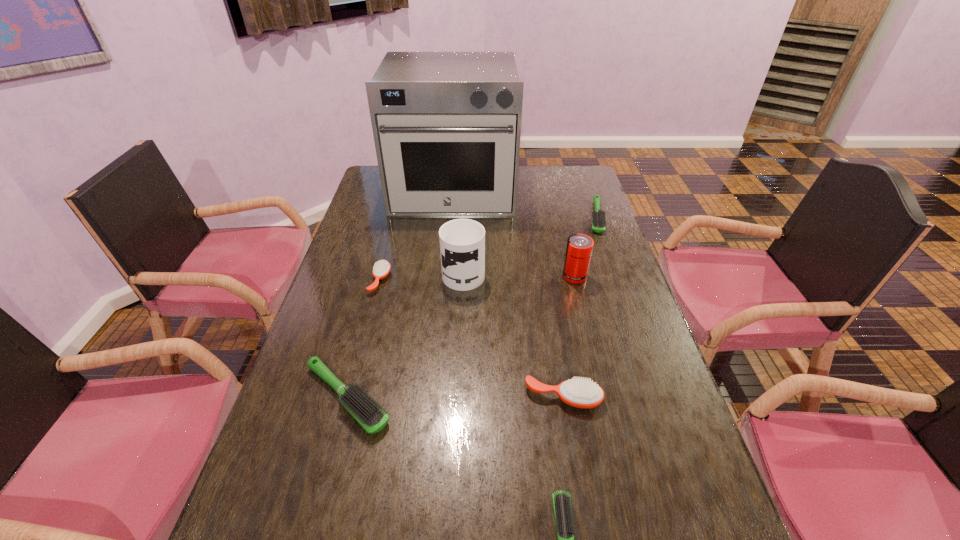
I want to click on the tallest object, so click(447, 125).

At what (x,y) coordinates should I click in order to perform the action: click on the seventh shortest object. Please return your answer as a coordinate pair (x, y). This screenshot has width=960, height=540. Looking at the image, I should click on (462, 241).

At what (x,y) coordinates should I click in order to perform the action: click on mug. Please return your answer as a coordinate pair (x, y). Image resolution: width=960 pixels, height=540 pixels. Looking at the image, I should click on (462, 241).

The height and width of the screenshot is (540, 960). What are the coordinates of `the third tallest object` in the screenshot? It's located at (579, 248).

What are the coordinates of `the bigger orange hairbrush` in the screenshot? It's located at (582, 393).

This screenshot has height=540, width=960. I want to click on the right orange hairbrush, so click(x=582, y=393).

Find the location of `the biggest light hairbrush`. the biggest light hairbrush is located at coordinates (367, 413).

The height and width of the screenshot is (540, 960). What are the coordinates of `the leftmost light hairbrush` in the screenshot? It's located at (367, 413).

In order to click on the farthest light hairbrush in this screenshot , I will do `click(598, 216)`.

Where is `the rightmost light hairbrush`? This screenshot has height=540, width=960. the rightmost light hairbrush is located at coordinates (598, 216).